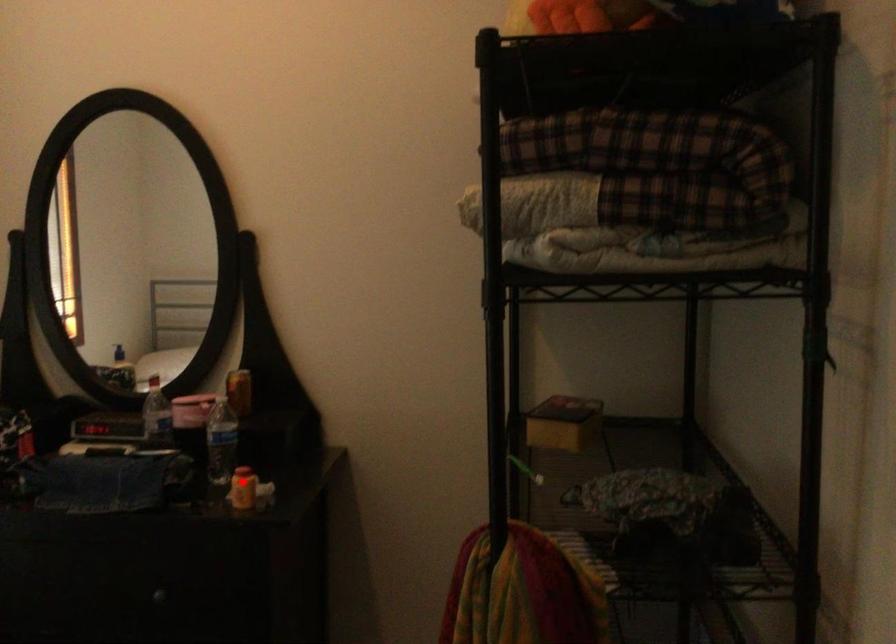
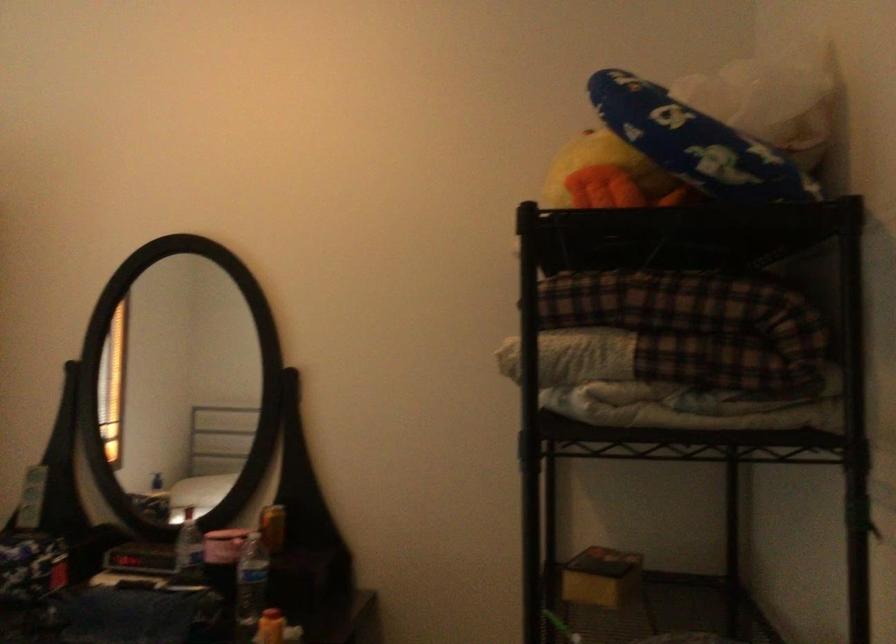
The point at the highlighted location is marked in the first image. Where is the corresponding point in the second image?

(270, 627)